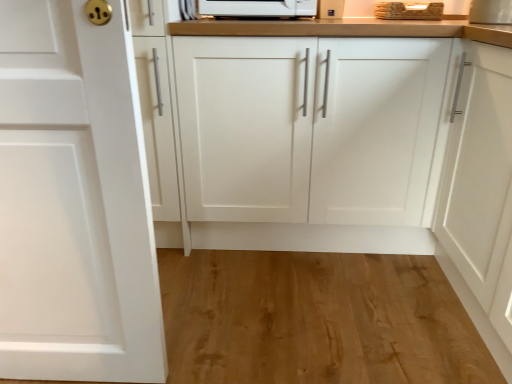
Question: Should I look upward or downward to see white matte cabinet at center, which appears as the second cabinetry when viewed from the left?

Choices:
 (A) up
 (B) down

Answer: (A)

Question: Is wooden at upper right located outside white matte cabinet door at left, acting as the 2th cabinetry starting from the back?

Choices:
 (A) no
 (B) yes

Answer: (B)

Question: Is wooden at upper right surrounding white matte cabinet door at left, placed as the second cabinetry when sorted from right to left?

Choices:
 (A) yes
 (B) no

Answer: (B)

Question: Does wooden at upper right come behind white matte cabinet door at left, which is the 1th cabinetry from front to back?

Choices:
 (A) yes
 (B) no

Answer: (A)

Question: Can you see wooden at upper right touching white matte cabinet door at left, placed as the second cabinetry when sorted from right to left?

Choices:
 (A) yes
 (B) no

Answer: (B)

Question: Could you tell me if wooden at upper right is facing white matte cabinet door at left, acting as the 2th cabinetry starting from the back?

Choices:
 (A) no
 (B) yes

Answer: (A)

Question: Is wooden at upper right taller than white matte cabinet door at left, placed as the first cabinetry when sorted from left to right?

Choices:
 (A) no
 (B) yes

Answer: (A)

Question: From a real-world perspective, is white matte cabinet at center, acting as the 2th cabinetry starting from the front, physically below wooden at upper right?

Choices:
 (A) no
 (B) yes

Answer: (B)

Question: Is white matte cabinet at center, which is the 1th cabinetry in back-to-front order, turned away from wooden at upper right?

Choices:
 (A) yes
 (B) no

Answer: (B)

Question: Can you confirm if white matte cabinet at center, the first cabinetry in the right-to-left sequence, is shorter than wooden at upper right?

Choices:
 (A) no
 (B) yes

Answer: (A)

Question: From a real-world perspective, is white matte cabinet at center, which is the 1th cabinetry in back-to-front order, positioned over wooden at upper right based on gravity?

Choices:
 (A) yes
 (B) no

Answer: (B)

Question: Can you confirm if white matte cabinet at center, which appears as the second cabinetry when viewed from the left, is smaller than wooden at upper right?

Choices:
 (A) yes
 (B) no

Answer: (B)

Question: Is white matte cabinet at center, which is the 1th cabinetry in back-to-front order, in front of wooden at upper right?

Choices:
 (A) yes
 (B) no

Answer: (A)

Question: Can you confirm if white matte cabinet door at left, placed as the first cabinetry when sorted from left to right, is wider than natural wood flooring at lower center?

Choices:
 (A) yes
 (B) no

Answer: (B)